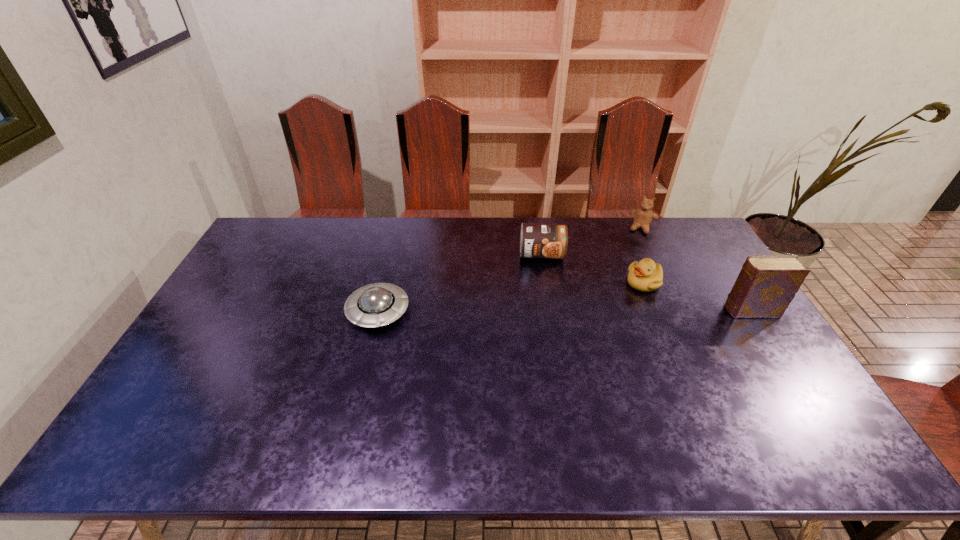
The width and height of the screenshot is (960, 540). I want to click on free space on the desktop that is between the shortest object and the rightmost object and is positioned on the front-facing side of the duckling, so click(601, 311).

The height and width of the screenshot is (540, 960). I want to click on vacant spot on the desktop that is between the shortest object and the tallest object and is positioned on the front label of the second object from left to right, so click(545, 311).

Identify the location of vacant spot on the desktop that is between the leftmost object and the tallest object and is positioned on the face of the farthest object. (619, 311).